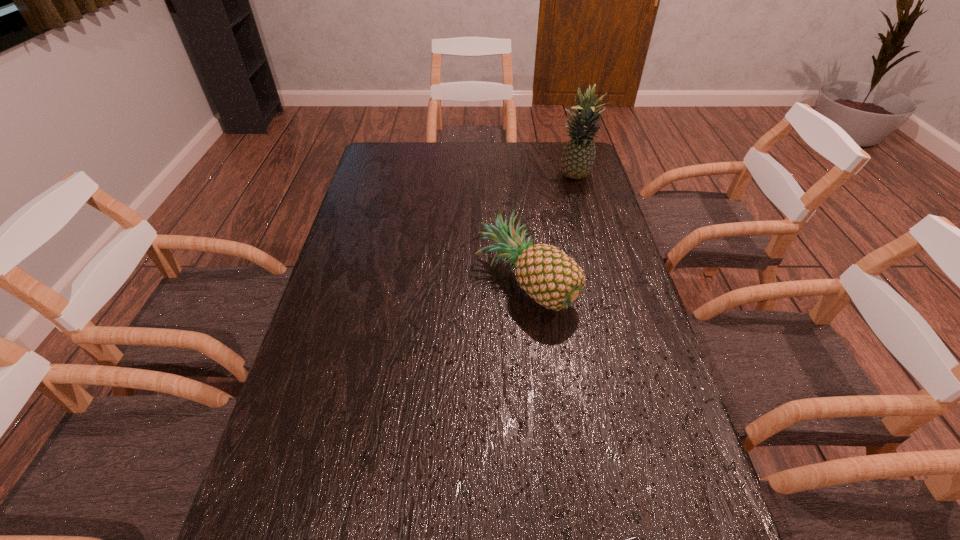
This screenshot has width=960, height=540. In order to click on vacant space at the left edge of the desktop in this screenshot , I will do `click(375, 256)`.

In the image, there is a desktop. In order to click on vacant space at the right edge in this screenshot , I will do `click(610, 369)`.

Where is `vacant region at the far left corner of the desktop`? This screenshot has height=540, width=960. vacant region at the far left corner of the desktop is located at coordinates (372, 172).

You are a GUI agent. You are given a task and a screenshot of the screen. Output one action in this format:
    pyautogui.click(x=<x>, y=<y>)
    Task: Click on the free point between the tallest object and the nearer pineapple
    The width and height of the screenshot is (960, 540).
    Given the screenshot: What is the action you would take?
    pyautogui.click(x=550, y=230)

At what (x,y) coordinates should I click in order to perform the action: click on vacant area that lies between the left pineapple and the tallest object. Please return your answer as a coordinate pair (x, y). This screenshot has height=540, width=960. Looking at the image, I should click on (550, 230).

The height and width of the screenshot is (540, 960). Find the location of `free space between the farther pineapple and the second tallest object`. free space between the farther pineapple and the second tallest object is located at coordinates (550, 230).

Find the location of a particular element. The height and width of the screenshot is (540, 960). vacant space that's between the farther pineapple and the shorter pineapple is located at coordinates (550, 230).

This screenshot has width=960, height=540. Identify the location of vacant area between the rightmost object and the nearer pineapple. (550, 230).

Identify the location of vacant space in between the farthest object and the shorter pineapple. The height and width of the screenshot is (540, 960). (550, 230).

Select which object is the second closest to the shortest object. Please provide its 2D coordinates. Your answer should be formatted as a tuple, i.e. [(x, y)], where the tuple contains the x and y coordinates of a point satisfying the conditions above.

[(578, 158)]